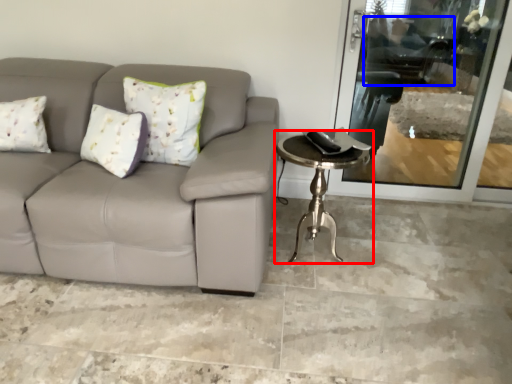
Question: Among these objects, which one is nearest to the camera, table (highlighted by a red box) or swivel chair (highlighted by a blue box)?

Choices:
 (A) table
 (B) swivel chair

Answer: (A)